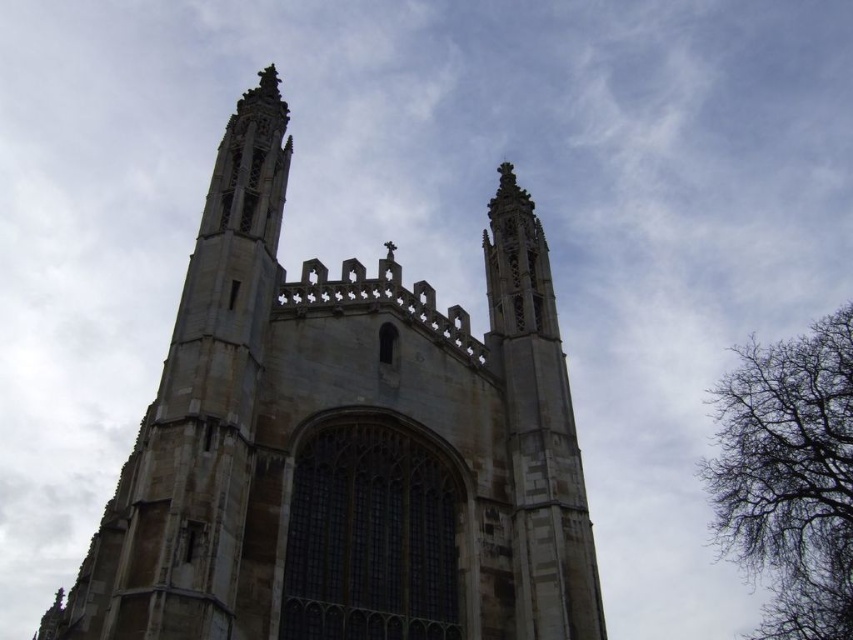
You are standing in front of the grand Gothic building and notice two points marked on the facade. The first point is located at coordinates point (529,317), and the second at point (821,552). From your vantage point, which point appears closer to you?

Point (529,317) is in front of point (821,552), so it appears closer to you.

You are standing in a park and see the stone church at center and the bare branches at right in the distance. Which object is located to the left of the other?

The stone church at center is positioned on the left side of bare branches at right, so the stone church at center is to the left of the bare branches at right.

You are standing in a park and see the stone church at center and the bare branches at right. Which object is closer to you?

The stone church at center is closer to you because it is in front of the bare branches at right.